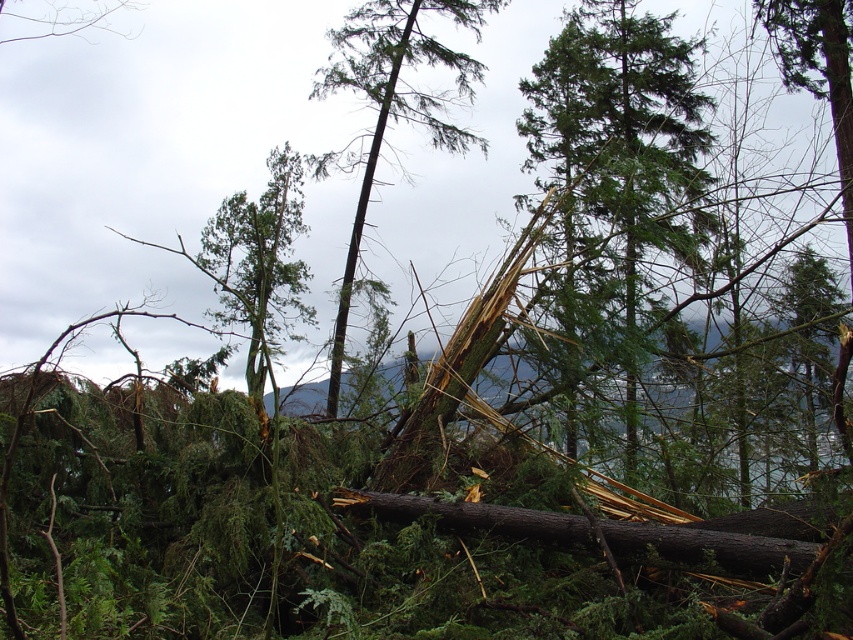
You are standing in the damaged forest and want to reach a point that is closer to you. Which point should you head towards, point (x=569, y=124) or point (x=376, y=51)?

You should head towards point (x=376, y=51) because it is closer to you than point (x=569, y=124).